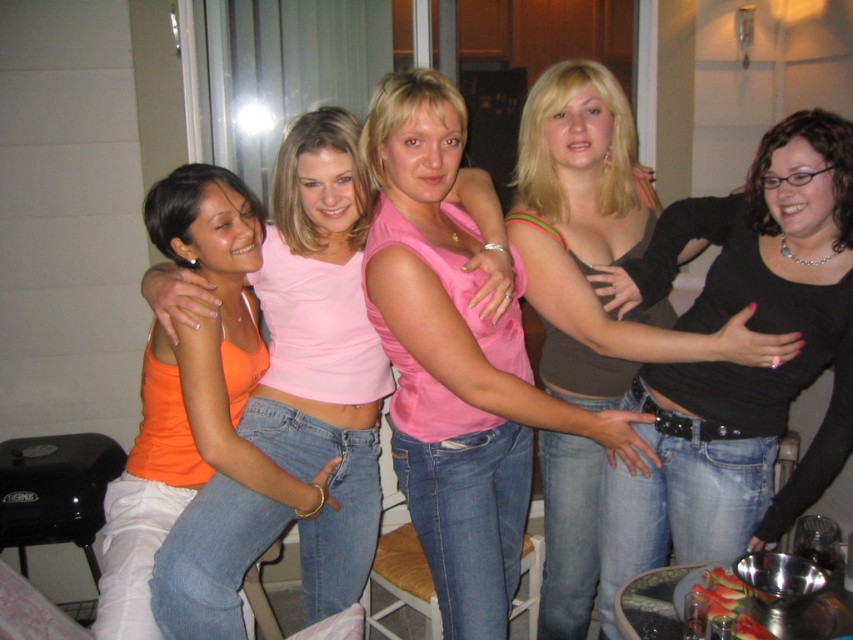
You are trying to decide which tank top to wear for a casual gathering. You see the pink matte tank top at center and the orange matte tank top at center in the image. Which one is covering the other?

The pink matte tank top at center is positioned over the orange matte tank top at center, so it is covering the orange one.

Based on the photo, you are a photographer trying to capture a closeup of the pink matte tank top at center and the matte pink tank top at center. Which one should you focus on to ensure it appears clearer in the photo?

The pink matte tank top at center should be focused on because it is closer to the viewer than the matte pink tank top at center, making it clearer when in focus.